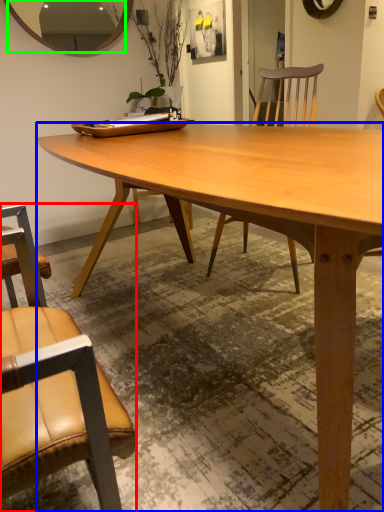
Question: Considering the real-world distances, which object is closest to chair (highlighted by a red box)? desk (highlighted by a blue box) or mirror (highlighted by a green box).

Choices:
 (A) desk
 (B) mirror

Answer: (A)